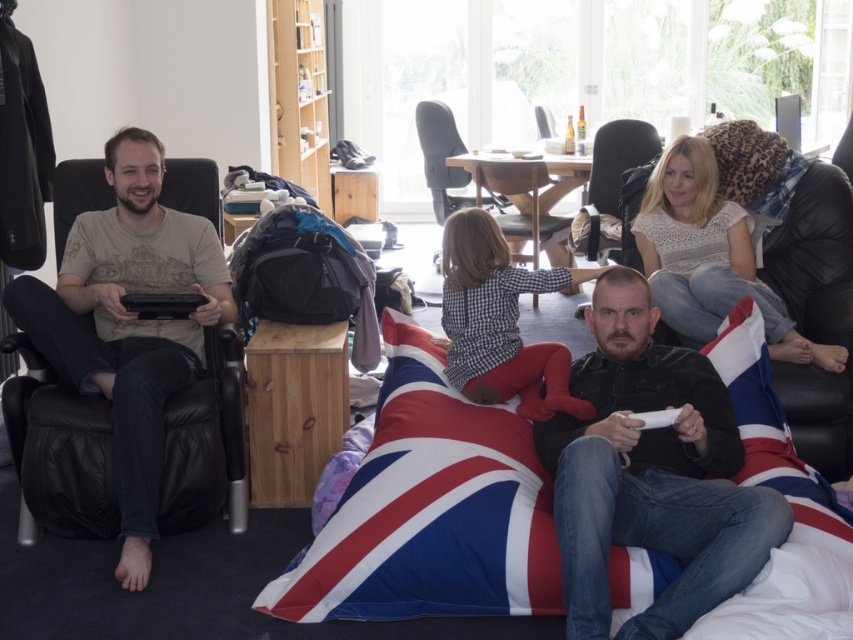
Question: Which object is the closest to the black leather jacket at center?

Choices:
 (A) union jack fabric bean bag at center
 (B) black leather chair at upper right
 (C) white plastic remote at lower center

Answer: (C)

Question: Is light brown cotton t-shirt at left in front of white plastic remote at lower center?

Choices:
 (A) no
 (B) yes

Answer: (A)

Question: Is union jack fabric at lower center positioned in front of black leather chair at upper right?

Choices:
 (A) no
 (B) yes

Answer: (B)

Question: Among these objects, which one is nearest to the camera?

Choices:
 (A) matte gray office chair at center
 (B) union jack fabric bean bag at center

Answer: (B)

Question: Which object is closer to the camera taking this photo?

Choices:
 (A) light brown cotton t-shirt at left
 (B) union jack fabric at lower center
 (C) black leather chair at upper right

Answer: (B)

Question: Is the position of union jack fabric bean bag at center less distant than that of black leather chair at upper right?

Choices:
 (A) no
 (B) yes

Answer: (B)